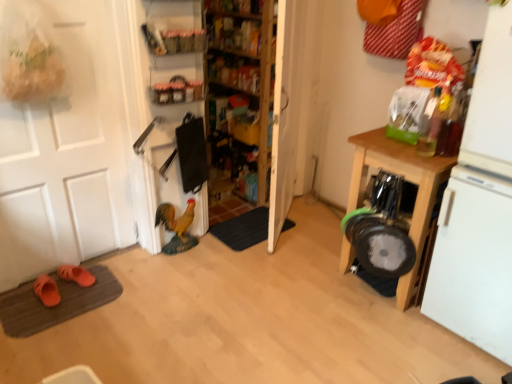
You are a GUI agent. You are given a task and a screenshot of the screen. Output one action in this format:
    pyautogui.click(x=<x>, y=<y>)
    Task: Click on the free space in front of orange suede slippers at lower left, which is the 2th footwear from front to back
    
    Given the screenshot: What is the action you would take?
    pyautogui.click(x=67, y=304)